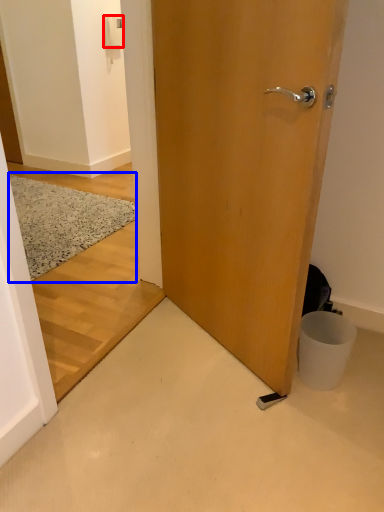
Question: Which object is closer to the camera taking this photo, light switch (highlighted by a red box) or doormat (highlighted by a blue box)?

Choices:
 (A) light switch
 (B) doormat

Answer: (B)